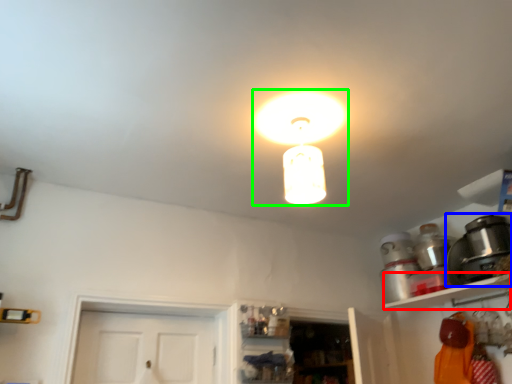
Question: Based on their relative distances, which object is nearer to shelf (highlighted by a red box)? Choose from appliance (highlighted by a blue box) and lamp (highlighted by a green box).

Choices:
 (A) appliance
 (B) lamp

Answer: (A)